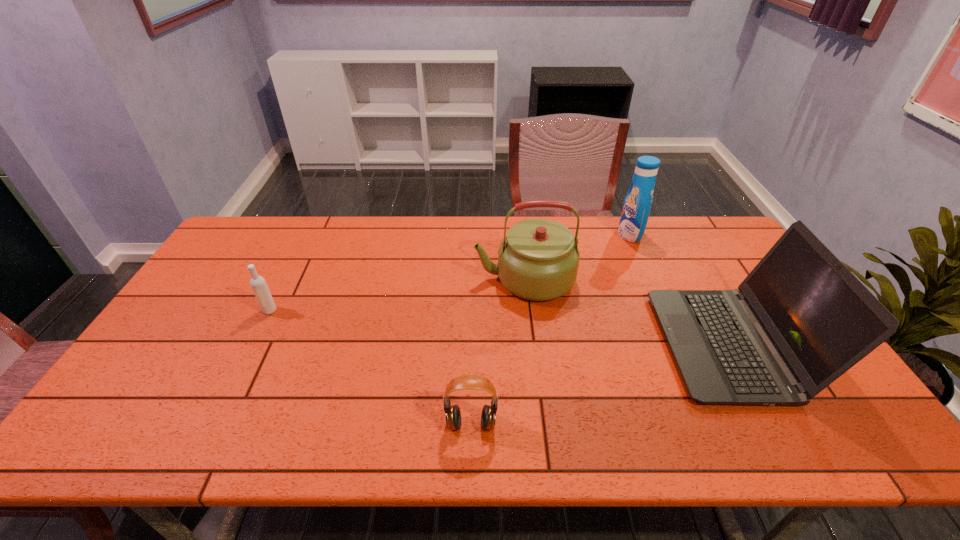
Identify the location of vacant area situated 0.180m at the spout of the kettle. (417, 279).

I want to click on vacant space located on the screen of the laptop_computer, so click(524, 345).

Locate an element on the screen. The width and height of the screenshot is (960, 540). vacant space located on the screen of the laptop_computer is located at coordinates (554, 345).

Image resolution: width=960 pixels, height=540 pixels. In order to click on vacant space located on the screen of the laptop_computer in this screenshot , I will do `click(610, 345)`.

I want to click on vacant region located on the left of the vodka, so click(222, 310).

This screenshot has height=540, width=960. I want to click on detergent positioned at the far edge, so click(x=637, y=205).

Identify the location of kettle at the far edge. This screenshot has width=960, height=540. (538, 260).

At what (x,y) coordinates should I click in order to perform the action: click on object situated at the near edge. Please return your answer as a coordinate pair (x, y). The height and width of the screenshot is (540, 960). Looking at the image, I should click on (467, 381).

In order to click on object positioned at the right edge in this screenshot , I will do `click(801, 319)`.

At what (x,y) coordinates should I click in order to perform the action: click on free space at the far edge. Please return your answer as a coordinate pair (x, y). The width and height of the screenshot is (960, 540). Looking at the image, I should click on pos(383,220).